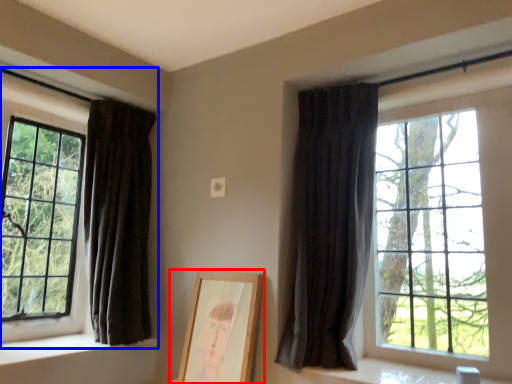
Question: Among these objects, which one is farthest to the camera, picture frame (highlighted by a red box) or window (highlighted by a blue box)?

Choices:
 (A) picture frame
 (B) window

Answer: (B)